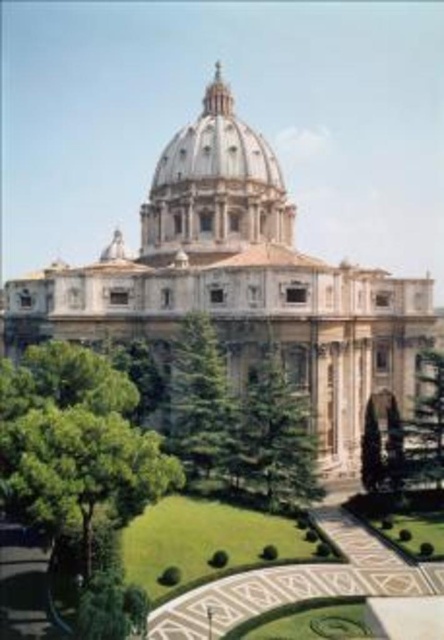
Question: From the image, what is the correct spatial relationship of white marble dome at center in relation to green leafy tree at right?

Choices:
 (A) above
 (B) below

Answer: (A)

Question: Which object is the farthest from the white marble dome at center?

Choices:
 (A) green leafy tree at lower left
 (B) green leafy tree at right
 (C) green textured tree at center

Answer: (A)

Question: Is white marble dome at center smaller than green leafy tree at right?

Choices:
 (A) yes
 (B) no

Answer: (B)

Question: Which point is farther from the camera taking this photo?

Choices:
 (A) (62, 490)
 (B) (433, 419)

Answer: (B)

Question: Which point is closer to the camera?

Choices:
 (A) green leafy tree at right
 (B) white marble palace at center
 (C) white marble dome at center
 (D) green textured tree at center

Answer: (D)

Question: Does green leafy tree at lower left come in front of white marble dome at center?

Choices:
 (A) yes
 (B) no

Answer: (A)